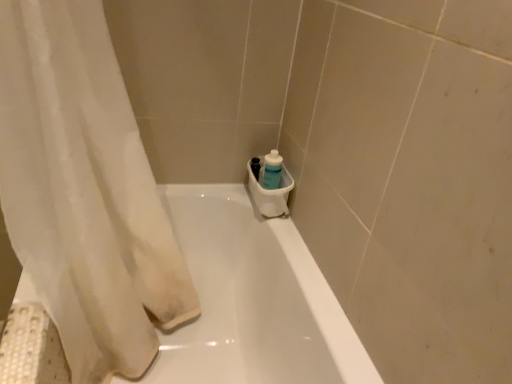
What do you see at coordinates (84, 190) in the screenshot? The width and height of the screenshot is (512, 384). I see `white sheer curtain at left` at bounding box center [84, 190].

This screenshot has height=384, width=512. Find the location of `white sheer curtain at left`. white sheer curtain at left is located at coordinates (84, 190).

The image size is (512, 384). I want to click on white sheer curtain at left, so click(84, 190).

Is translucent plastic bottle at lower right inside the boundaries of white sheer curtain at left, or outside?

translucent plastic bottle at lower right is located beyond the bounds of white sheer curtain at left.

Is translucent plastic bottle at lower right bigger than white sheer curtain at left?

No.

From a real-world perspective, does translucent plastic bottle at lower right sit lower than white sheer curtain at left?

Indeed, from a real-world perspective, translucent plastic bottle at lower right is positioned beneath white sheer curtain at left.

From a real-world perspective, relative to white glossy bathtub at center, is white sheer curtain at left vertically above or below?

Clearly, from a real-world perspective, white sheer curtain at left is above white glossy bathtub at center.

Does white sheer curtain at left turn towards white glossy bathtub at center?

No, white sheer curtain at left is not turned towards white glossy bathtub at center.

Is white sheer curtain at left touching white glossy bathtub at center?

white sheer curtain at left and white glossy bathtub at center are clearly separated.

Which is in front, white sheer curtain at left or white glossy bathtub at center?

white sheer curtain at left is in front.

Which object is thinner, translucent plastic bottle at lower right or white glossy bathtub at center?

Thinner between the two is translucent plastic bottle at lower right.

Considering the positions of objects translucent plastic bottle at lower right and white glossy bathtub at center in the image provided, who is behind, translucent plastic bottle at lower right or white glossy bathtub at center?

translucent plastic bottle at lower right is more distant.

From the image's perspective, is translucent plastic bottle at lower right on top of white glossy bathtub at center?

Yes, from the image's perspective, translucent plastic bottle at lower right is above white glossy bathtub at center.

Is translucent plastic bottle at lower right looking in the opposite direction of white glossy bathtub at center?

No, translucent plastic bottle at lower right is not facing the opposite direction of white glossy bathtub at center.

Would you say white glossy bathtub at center is a long distance from white sheer curtain at left?

They are positioned close to each other.

Looking at this image, considering the relative positions of white glossy bathtub at center and white sheer curtain at left in the image provided, is white glossy bathtub at center to the left or to the right of white sheer curtain at left?

white glossy bathtub at center is positioned on white sheer curtain at left's right side.

Could you tell me if white glossy bathtub at center is facing white sheer curtain at left?

A: Yes, white glossy bathtub at center is oriented towards white sheer curtain at left.

Find the location of `curtain located above the white glossy bathtub at center (from the image's perspective)`. curtain located above the white glossy bathtub at center (from the image's perspective) is located at coordinates (84, 190).

Which is less distant, (x=172, y=265) or (x=276, y=188)?

Point (x=172, y=265).

Is the depth of white sheer curtain at left greater than that of translucent plastic bottle at lower right?

No, white sheer curtain at left is in front of translucent plastic bottle at lower right.

At what (x,y) coordinates should I click in order to perform the action: click on cleaning product that appears above the white sheer curtain at left (from the image's perspective). Please return your answer as a coordinate pair (x, y). Looking at the image, I should click on (271, 170).

Based on the photo, from a real-world perspective, does white glossy bathtub at center stand above translucent plastic bottle at lower right?

No, from a real-world perspective, white glossy bathtub at center is not on top of translucent plastic bottle at lower right.

Is white glossy bathtub at center smaller than translucent plastic bottle at lower right?

No.

Does white glossy bathtub at center appear on the right side of translucent plastic bottle at lower right?

Incorrect, white glossy bathtub at center is not on the right side of translucent plastic bottle at lower right.

Image resolution: width=512 pixels, height=384 pixels. What are the coordinates of `curtain below the translucent plastic bottle at lower right (from the image's perspective)` in the screenshot? It's located at (84, 190).

Locate an element on the screen. Image resolution: width=512 pixels, height=384 pixels. curtain lying on the left of white glossy bathtub at center is located at coordinates (84, 190).

Looking at the image, which one is located closer to white sheer curtain at left, white glossy bathtub at center or translucent plastic bottle at lower right?

white glossy bathtub at center.

In the scene shown: Looking at the image, which one is located further to translucent plastic bottle at lower right, white glossy bathtub at center or white sheer curtain at left?

white sheer curtain at left.

From the image, which object appears to be farther from white glossy bathtub at center, white sheer curtain at left or translucent plastic bottle at lower right?

translucent plastic bottle at lower right is positioned further to the anchor white glossy bathtub at center.

Based on their spatial positions, is white sheer curtain at left or white glossy bathtub at center further from translucent plastic bottle at lower right?

The object further to translucent plastic bottle at lower right is white sheer curtain at left.

When comparing their distances from white glossy bathtub at center, does translucent plastic bottle at lower right or white sheer curtain at left seem further?

Among the two, translucent plastic bottle at lower right is located further to white glossy bathtub at center.

Based on their spatial positions, is translucent plastic bottle at lower right or white glossy bathtub at center closer to white sheer curtain at left?

white glossy bathtub at center is positioned closer to the anchor white sheer curtain at left.

Locate an element on the screen. bathtub between white sheer curtain at left and translucent plastic bottle at lower right along the z-axis is located at coordinates (253, 300).